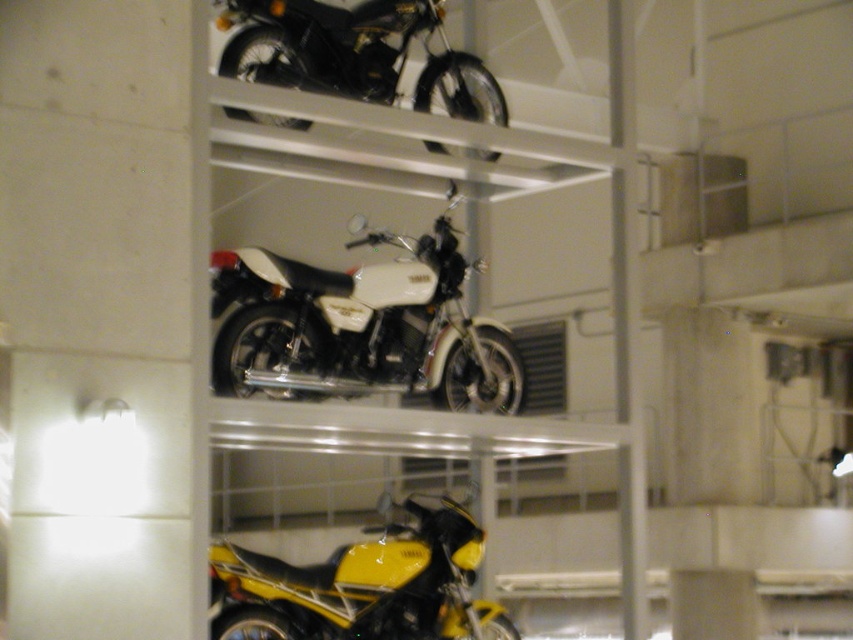
Is white matte motorcycle at center wider than shiny black motorcycle at upper center?

Correct, the width of white matte motorcycle at center exceeds that of shiny black motorcycle at upper center.

Between white matte motorcycle at center and shiny black motorcycle at upper center, which one has less height?

shiny black motorcycle at upper center

Identify the location of white matte motorcycle at center. The image size is (853, 640). (363, 324).

Which is below, white matte motorcycle at center or yellow glossy motorcycle at lower center?

Positioned lower is yellow glossy motorcycle at lower center.

Identify the location of white matte motorcycle at center. (363, 324).

Can you confirm if yellow glossy motorcycle at lower center is wider than shiny black motorcycle at upper center?

Indeed, yellow glossy motorcycle at lower center has a greater width compared to shiny black motorcycle at upper center.

Can you confirm if yellow glossy motorcycle at lower center is positioned to the right of shiny black motorcycle at upper center?

No, yellow glossy motorcycle at lower center is not to the right of shiny black motorcycle at upper center.

Where is `yellow glossy motorcycle at lower center`? The image size is (853, 640). yellow glossy motorcycle at lower center is located at coordinates (363, 586).